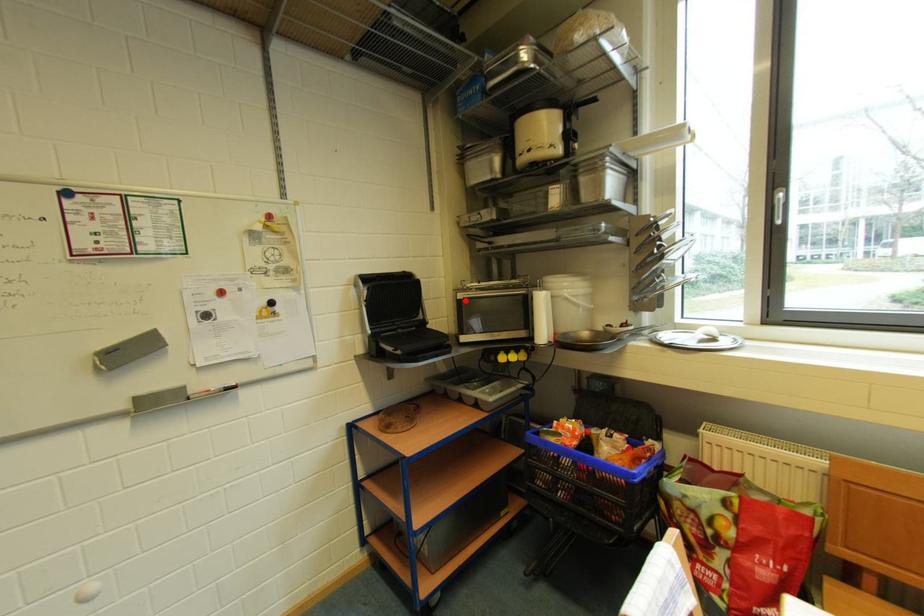
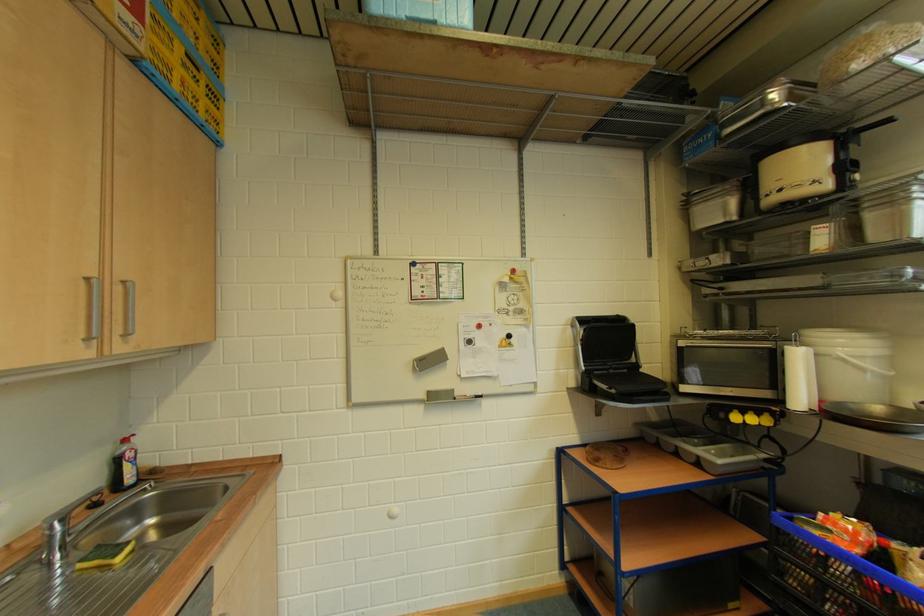
Where in the second image is the point corresponding to the highlighted location from the first image?

(687, 347)